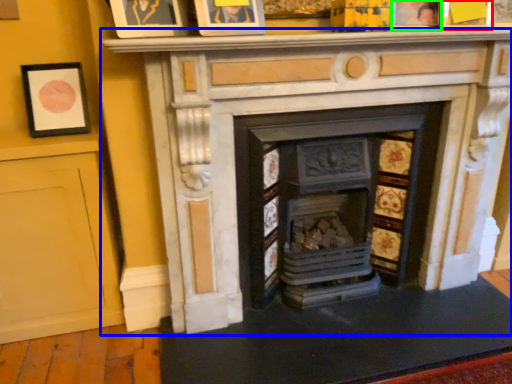
Question: Which object is positioned farthest from picture frame (highlighted by a red box)? Select from fireplace (highlighted by a blue box) and picture frame (highlighted by a green box).

Choices:
 (A) fireplace
 (B) picture frame

Answer: (A)